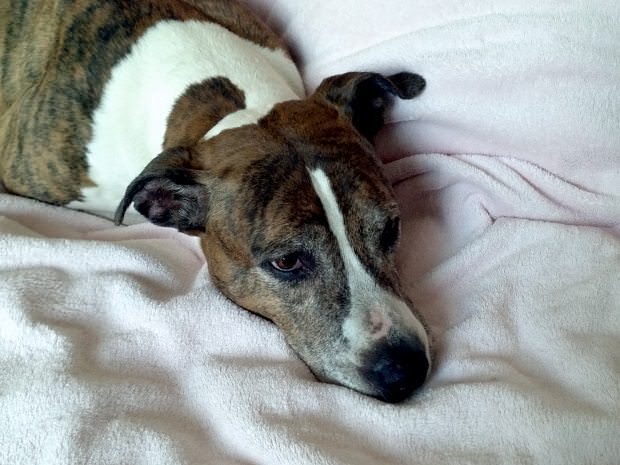
Locate an element on the screen. bluish white light reflections on blanket is located at coordinates (30, 401), (240, 430), (126, 308), (20, 329).